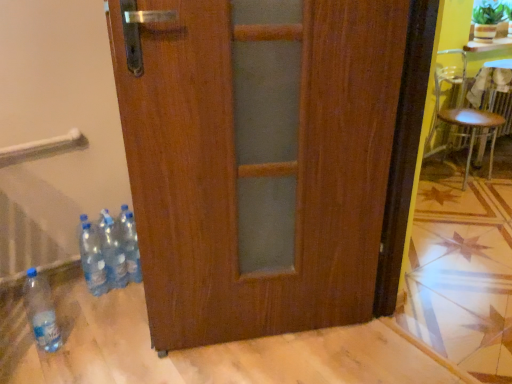
Image resolution: width=512 pixels, height=384 pixels. Find the location of `free space to the right of transparent plastic bottles at lower left, the 2th bottle positioned from the left`. free space to the right of transparent plastic bottles at lower left, the 2th bottle positioned from the left is located at coordinates (123, 302).